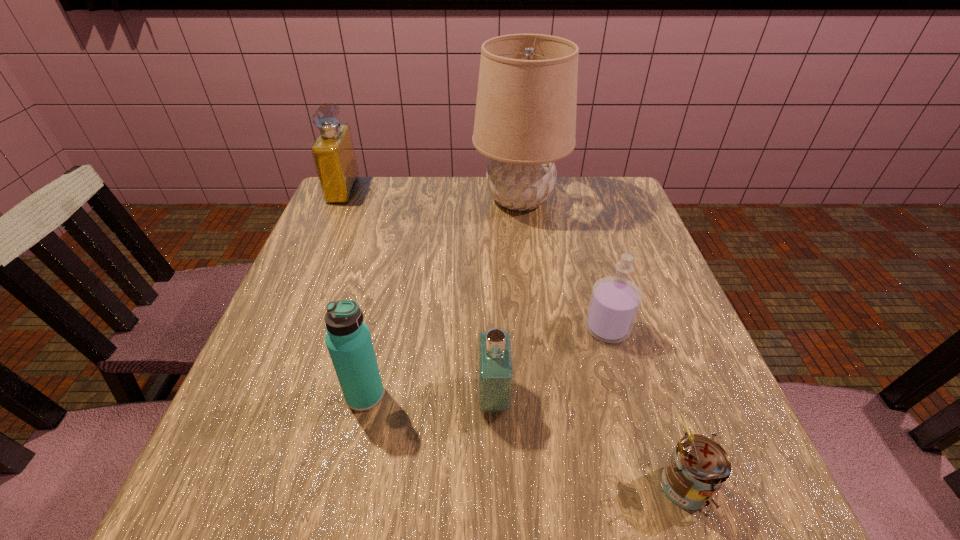
The height and width of the screenshot is (540, 960). I want to click on object present at the left edge, so click(333, 152).

This screenshot has height=540, width=960. What are the coordinates of `perfume at the right edge` in the screenshot? It's located at (615, 301).

You are a GUI agent. You are given a task and a screenshot of the screen. Output one action in this format:
    pyautogui.click(x=<x>, y=<y>)
    Task: Click on the can positioned at the right edge
    The width and height of the screenshot is (960, 540).
    Given the screenshot: What is the action you would take?
    pyautogui.click(x=697, y=469)

Find the location of `object positioned at the far left corner`. object positioned at the far left corner is located at coordinates (333, 152).

Locate an element on the screen. object located at the near right corner is located at coordinates (697, 469).

The height and width of the screenshot is (540, 960). I want to click on free space at the far edge of the desktop, so click(x=446, y=191).

The image size is (960, 540). I want to click on vacant space at the near edge, so click(x=531, y=479).

This screenshot has width=960, height=540. I want to click on vacant space at the left edge of the desktop, so click(x=356, y=275).

Where is `vacant space at the right edge of the desktop`? This screenshot has height=540, width=960. vacant space at the right edge of the desktop is located at coordinates (681, 323).

In the image, there is a desktop. Where is `vacant space at the far left corner`? vacant space at the far left corner is located at coordinates (384, 197).